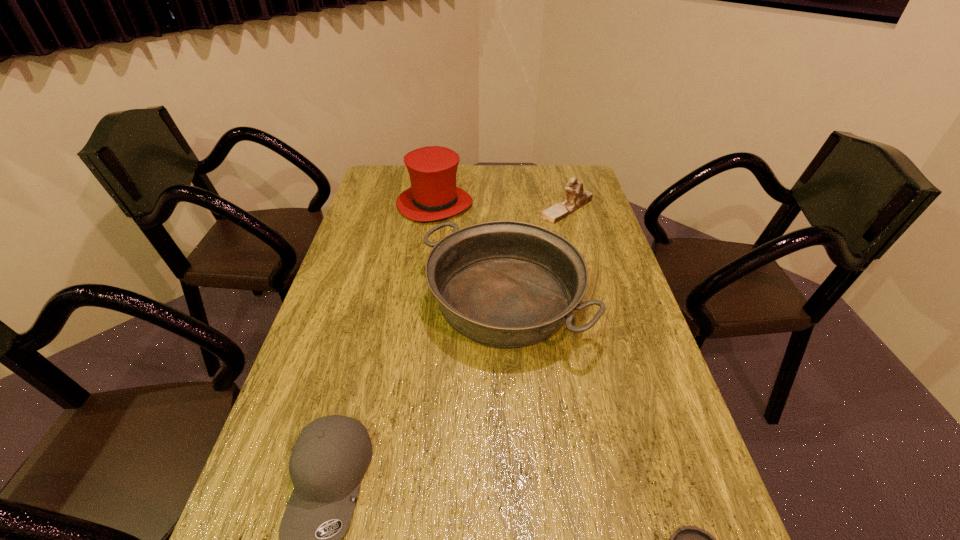
You are a GUI agent. You are given a task and a screenshot of the screen. Output one action in this format:
    pyautogui.click(x=<x>, y=<y>)
    Task: Click on the tallest object
    The height and width of the screenshot is (540, 960).
    Given the screenshot: What is the action you would take?
    pyautogui.click(x=433, y=195)

You are a GUI agent. You are given a task and a screenshot of the screen. Output one action in this format:
    pyautogui.click(x=<x>, y=<y>)
    Task: Click on the third nearest object
    The width and height of the screenshot is (960, 540).
    Given the screenshot: What is the action you would take?
    pyautogui.click(x=507, y=284)

This screenshot has height=540, width=960. In order to click on figurine in this screenshot , I will do `click(576, 197)`.

Where is `vacant area located 0.280m on the right of the hat`? This screenshot has width=960, height=540. vacant area located 0.280m on the right of the hat is located at coordinates (549, 204).

At what (x,y) coordinates should I click in order to perform the action: click on free location located on the back of the third nearest object. Please return your answer as a coordinate pair (x, y). Looking at the image, I should click on (499, 224).

Where is `vacant space located on the front-facing side of the figurine`? This screenshot has width=960, height=540. vacant space located on the front-facing side of the figurine is located at coordinates (492, 209).

Locate an element on the screen. The image size is (960, 540). vacant region located 0.140m on the front-facing side of the figurine is located at coordinates (500, 209).

What are the coordinates of `vacant space located 0.330m on the front-facing side of the figurine` in the screenshot? It's located at point(447,209).

Where is `hat located in the far edge section of the desktop`? hat located in the far edge section of the desktop is located at coordinates (433, 195).

Where is `figurine that is at the far edge`? The width and height of the screenshot is (960, 540). figurine that is at the far edge is located at coordinates (576, 197).